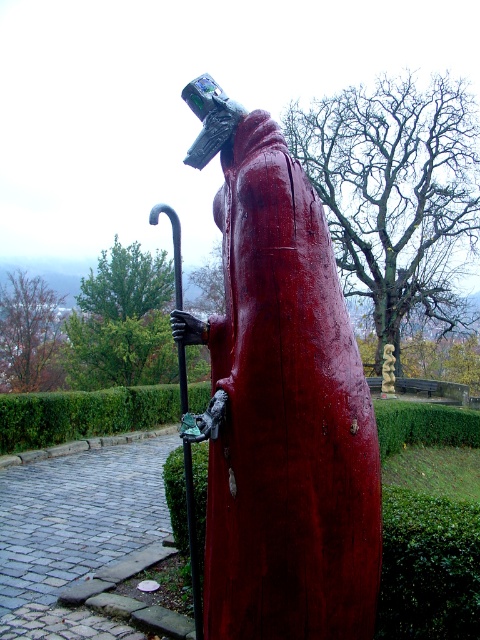
You are a park visitor who wants to take a photo of the black metal pole at center and the wooden spiral at center. Which object should you focus on first if you want to capture both in the same frame without moving your camera?

You should focus on the wooden spiral at center first because the black metal pole at center is positioned on the left side of it, so keeping the wooden spiral at center centered will ensure both objects are in the frame.

You are a gardener standing at the edge of the green hedge at lower left. You want to walk to the glossy wood statue at center. Which direction should you move to reach it?

The glossy wood statue at center is to the right of the green hedge at lower left, so you should move to your right to reach it.